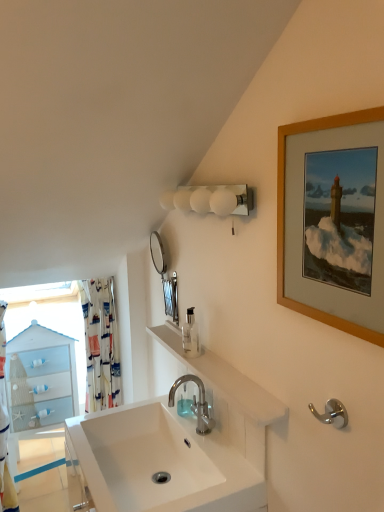
This screenshot has width=384, height=512. In order to click on free spot in front of polished chrome faucet at center in this screenshot , I will do `click(223, 459)`.